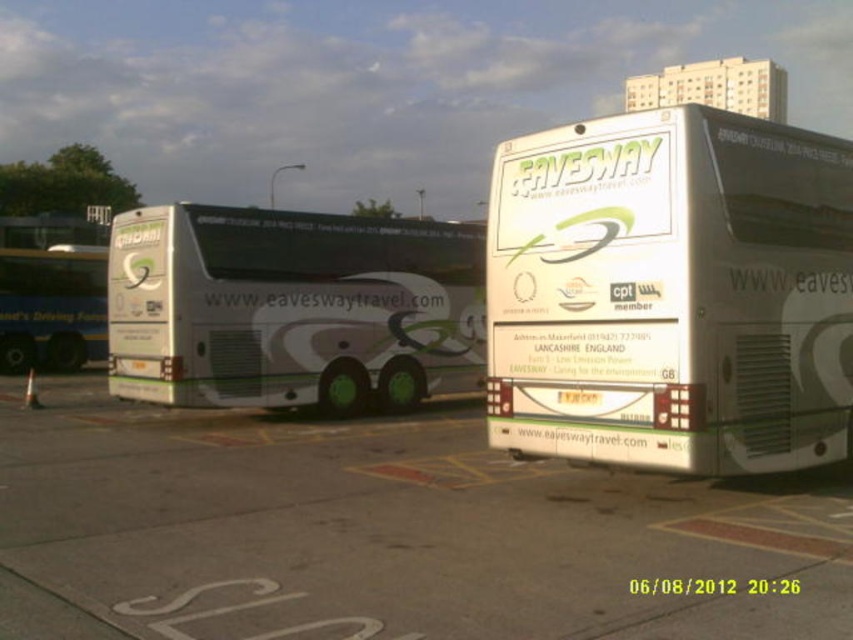
Question: Is white matte bus at center positioned before green matte bus at left?

Choices:
 (A) no
 (B) yes

Answer: (B)

Question: Among these objects, which one is farthest from the camera?

Choices:
 (A) green matte bus at left
 (B) white matte bus at center

Answer: (A)

Question: Which of the following is the closest to the observer?

Choices:
 (A) (300, 346)
 (B) (0, 621)

Answer: (B)

Question: Can you confirm if concrete pavement at center is positioned below white matte bus at center?

Choices:
 (A) yes
 (B) no

Answer: (A)

Question: Where is white matte bus at center located in relation to white matte bus at left in the image?

Choices:
 (A) right
 (B) left

Answer: (A)

Question: Which point appears farthest from the camera in this image?

Choices:
 (A) 248,554
 (B) 222,353
 (C) 701,150

Answer: (B)